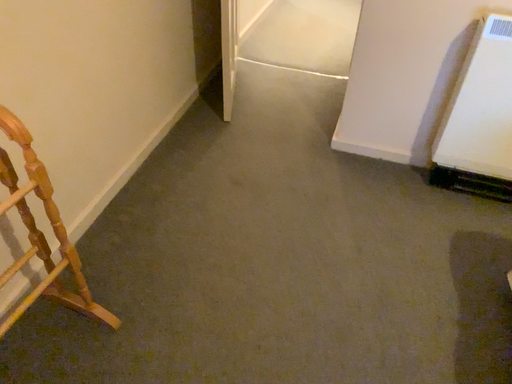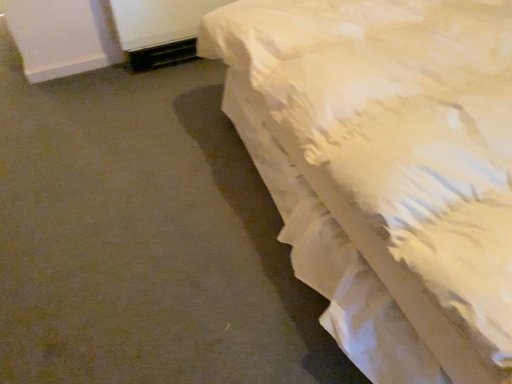
Question: How did the camera likely rotate when shooting the video?

Choices:
 (A) rotated right
 (B) rotated left

Answer: (A)